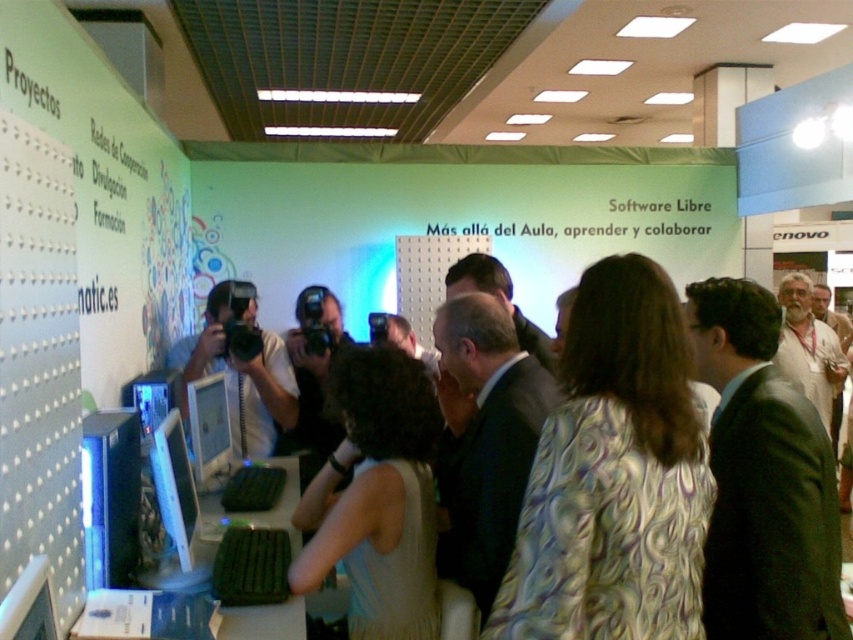
Is matte black monitor at center shorter than matte white monitor at center?

Indeed, matte black monitor at center has a lesser height compared to matte white monitor at center.

At what (x,y) coordinates should I click in order to perform the action: click on matte black monitor at center. Please return your answer as a coordinate pair (x, y). This screenshot has width=853, height=640. Looking at the image, I should click on [x=173, y=484].

Which is more to the right, matte black camera at center or matte black monitor at lower left?

From the viewer's perspective, matte black monitor at lower left appears more on the right side.

Can you confirm if matte black camera at center is smaller than matte black monitor at lower left?

No.

I want to click on matte black camera at center, so click(x=241, y=378).

Can you confirm if matte black camera at center is shorter than matte white monitor at center?

Incorrect, matte black camera at center's height does not fall short of matte white monitor at center's.

Can you confirm if matte black camera at center is positioned above matte white monitor at center?

Indeed, matte black camera at center is positioned over matte white monitor at center.

The image size is (853, 640). I want to click on matte black camera at center, so click(241, 378).